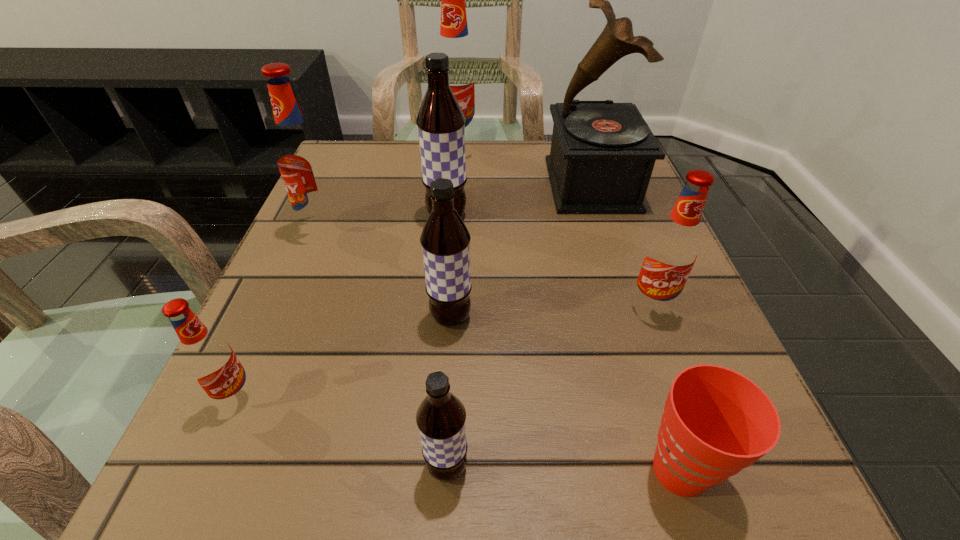
At what (x,y) coordinates should I click in order to perform the action: click on the farthest red root beer. Please return your answer as a coordinate pair (x, y). The width and height of the screenshot is (960, 540). Looking at the image, I should click on (454, 40).

Identify the location of the biggest red root beer. Image resolution: width=960 pixels, height=540 pixels. click(x=454, y=40).

Image resolution: width=960 pixels, height=540 pixels. I want to click on phonograph_record, so click(x=602, y=155).

Identify the location of the third smallest red root beer. This screenshot has height=540, width=960. (302, 160).

The width and height of the screenshot is (960, 540). I want to click on the farthest brown root beer, so click(441, 123).

Image resolution: width=960 pixels, height=540 pixels. Identify the location of the second smallest red root beer. click(x=672, y=251).

Locate an element on the screen. The height and width of the screenshot is (540, 960). the second nearest red root beer is located at coordinates (x=672, y=251).

Find the location of a particular element. This screenshot has width=960, height=540. the second biggest brown root beer is located at coordinates (445, 239).

At what (x,y) coordinates should I click in order to perform the action: click on the sixth farthest root beer. Please return your answer as a coordinate pair (x, y). This screenshot has width=960, height=540. Looking at the image, I should click on (209, 358).

Locate an element on the screen. Image resolution: width=960 pixels, height=540 pixels. the third nearest object is located at coordinates (209, 358).